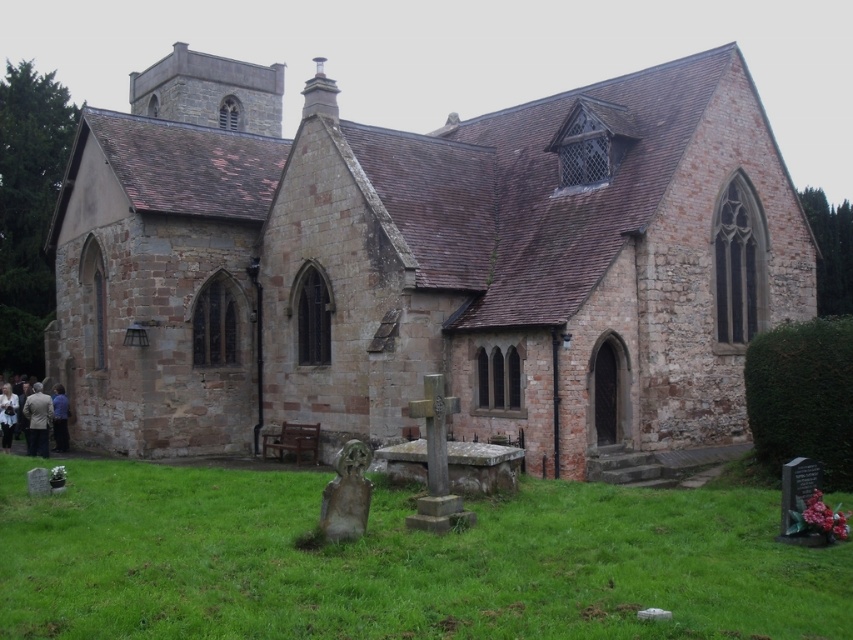
Can you confirm if brown stone church at center is shorter than green grass at lower center?

No.

Is point (198, 205) behind point (115, 502)?

Yes, point (198, 205) is farther from viewer.

Identify the location of brown stone church at center. coord(422,262).

Is green grass at lower center to the right of light brown suit at lower left from the viewer's perspective?

Indeed, green grass at lower center is positioned on the right side of light brown suit at lower left.

In the scene shown: Does green grass at lower center have a lesser width compared to light brown suit at lower left?

Incorrect, green grass at lower center's width is not less than light brown suit at lower left's.

Between point (776, 502) and point (41, 422), which one is positioned behind?

Positioned behind is point (41, 422).

The image size is (853, 640). Find the location of `green grass at lower center`. green grass at lower center is located at coordinates (399, 561).

In the scene shown: Who is positioned more to the right, brown stone church at center or light brown suit at lower left?

Positioned to the right is brown stone church at center.

What are the coordinates of `brown stone church at center` in the screenshot? It's located at (422, 262).